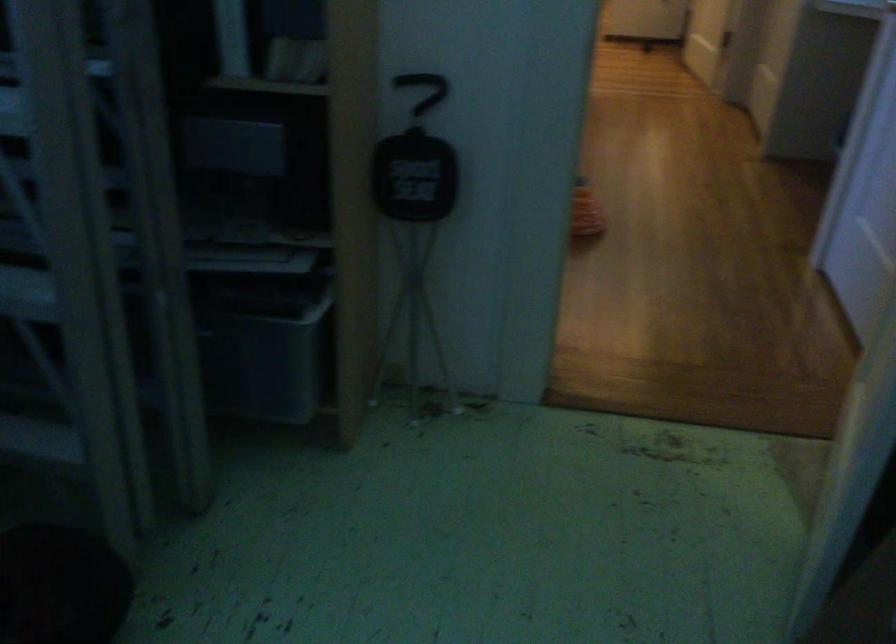
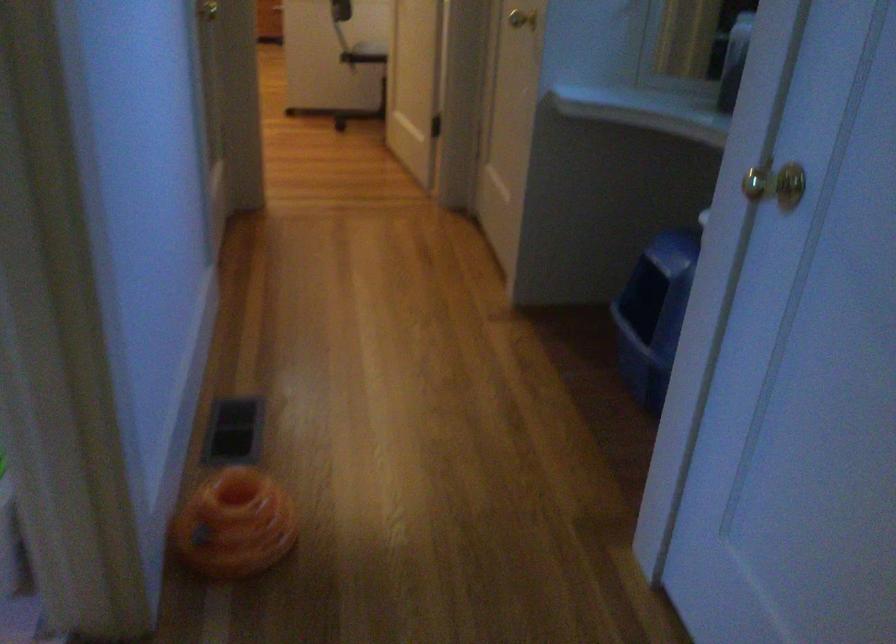
Question: The images are taken continuously from a first-person perspective. In which direction are you moving?

Choices:
 (A) Left
 (B) Right
 (C) Forward
 (D) Backward

Answer: (C)